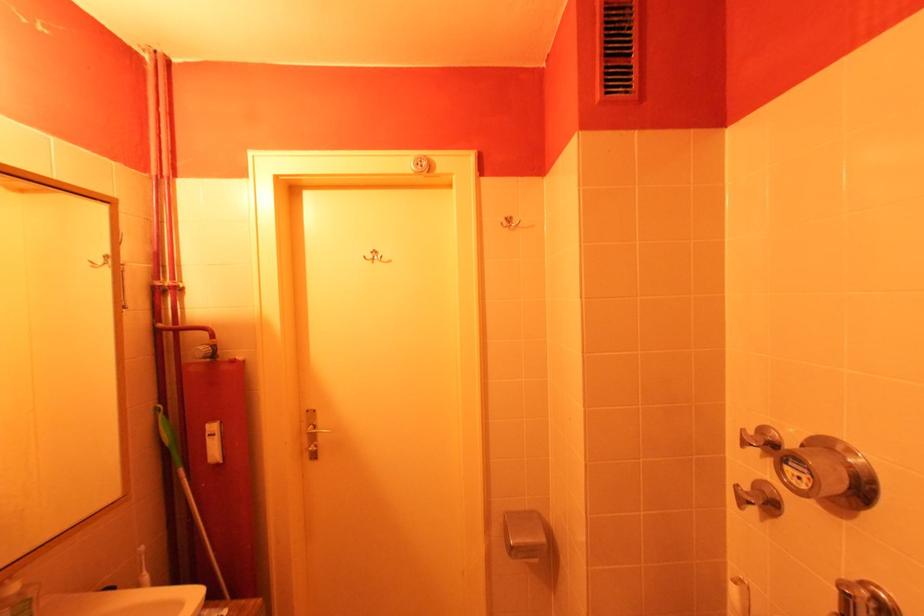
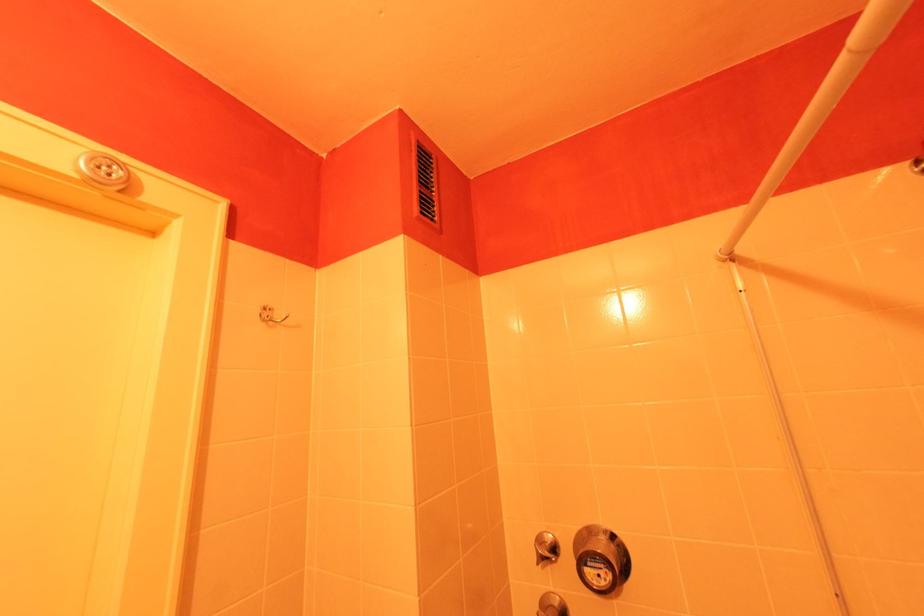
How did the camera likely rotate?

The camera's rotation is toward right-up.